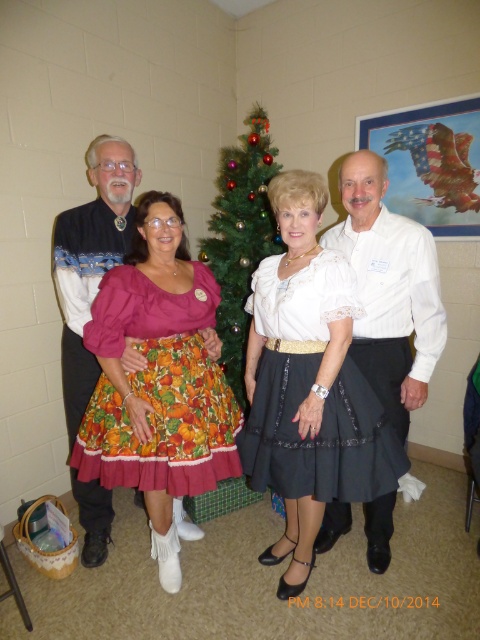
Question: Which object is the closest to the floral cotton skirt at center?

Choices:
 (A) green shiny christmas tree at center
 (B) printed cotton skirt at center

Answer: (B)

Question: Is printed cotton skirt at center to the right of green shiny christmas tree at center from the viewer's perspective?

Choices:
 (A) no
 (B) yes

Answer: (B)

Question: Considering the relative positions of floral cotton skirt at center and black satin dress at center in the image provided, where is floral cotton skirt at center located with respect to black satin dress at center?

Choices:
 (A) above
 (B) below

Answer: (A)

Question: Is white striped shirt at center bigger than matte black sweater at left?

Choices:
 (A) no
 (B) yes

Answer: (A)

Question: Which point is closer to the camera?

Choices:
 (A) printed cotton skirt at center
 (B) green shiny christmas tree at center

Answer: (A)

Question: Which is nearer to the printed cotton skirt at center?

Choices:
 (A) floral cotton skirt at center
 (B) white striped shirt at center
 (C) matte black sweater at left

Answer: (B)